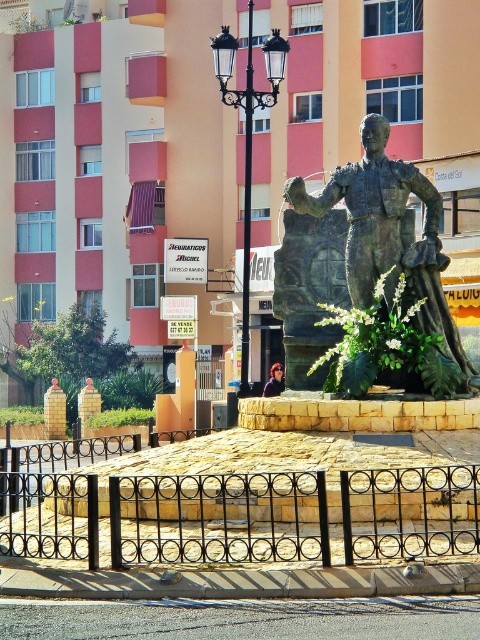
Question: Which point is closer to the camera taking this photo?

Choices:
 (A) (266, 396)
 (B) (245, 92)
 (C) (204, 1)

Answer: (B)

Question: Does bronze statue at center lie behind shiny red hair at center?

Choices:
 (A) yes
 (B) no

Answer: (B)

Question: Can you confirm if bronze statue at center is positioned below shiny red hair at center?

Choices:
 (A) yes
 (B) no

Answer: (B)

Question: Which of these objects is positioned closest to the black metal streetlight at center?

Choices:
 (A) beige concrete hotel at center
 (B) shiny red hair at center

Answer: (B)

Question: Which point is farther to the camera?

Choices:
 (A) (222, 67)
 (B) (372, 179)
 (C) (118, 138)

Answer: (C)

Question: Can you confirm if beige concrete hotel at center is positioned below black metal streetlight at center?

Choices:
 (A) yes
 (B) no

Answer: (A)